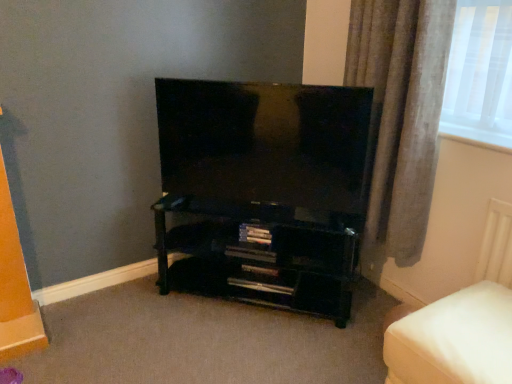
Question: Is black glossy tv at center inside or outside of black glossy shelf at lower center?

Choices:
 (A) inside
 (B) outside

Answer: (B)

Question: Is black glossy tv at center bigger or smaller than black glossy shelf at lower center?

Choices:
 (A) small
 (B) big

Answer: (A)

Question: Which object is positioned farthest from the black glossy tv at center?

Choices:
 (A) white fabric ottoman at lower right
 (B) black glossy shelf at lower center
 (C) gray fabric curtain at right

Answer: (A)

Question: Which object is positioned closest to the gray fabric curtain at right?

Choices:
 (A) white fabric ottoman at lower right
 (B) black glossy tv at center
 (C) black glossy shelf at lower center

Answer: (B)